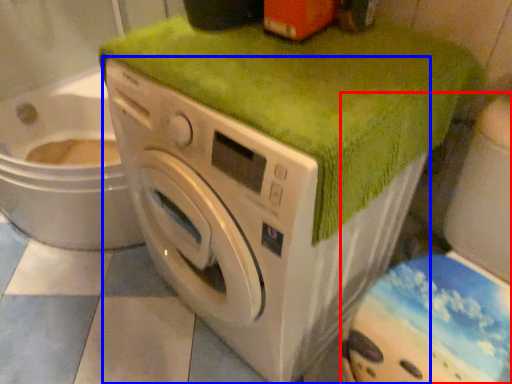
Question: Among these objects, which one is farthest to the camera, washer (highlighted by a red box) or washing machine (highlighted by a blue box)?

Choices:
 (A) washer
 (B) washing machine

Answer: (B)